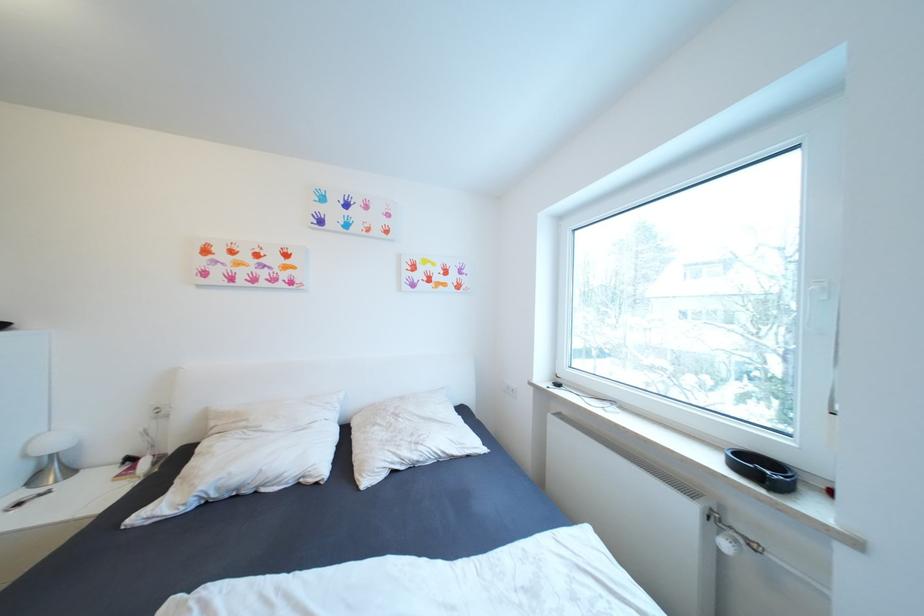
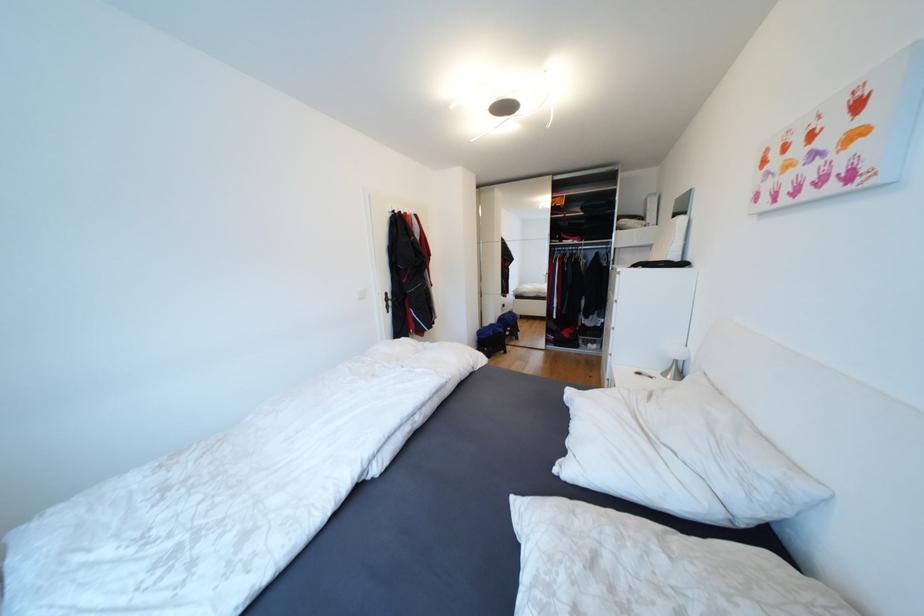
Locate, in the second image, the point that corresponds to (x=63, y=445) in the first image.

(682, 354)